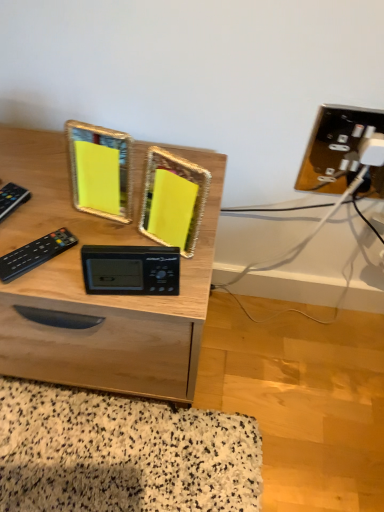
What do you see at coordinates (98, 295) in the screenshot? I see `wooden desk at center` at bounding box center [98, 295].

Image resolution: width=384 pixels, height=512 pixels. Find the location of `black plastic remote at left, which ranks as the second control in right-to-left order`. black plastic remote at left, which ranks as the second control in right-to-left order is located at coordinates (12, 198).

Considering the relative positions of black plastic clock at center and black plastic remote at left, the first control viewed from the right, in the image provided, is black plastic clock at center to the left of black plastic remote at left, the first control viewed from the right, from the viewer's perspective?

Incorrect, black plastic clock at center is not on the left side of black plastic remote at left, the first control viewed from the right.

In terms of width, does black plastic clock at center look wider or thinner when compared to black plastic remote at left, the first control viewed from the right?

Considering their sizes, black plastic clock at center looks slimmer than black plastic remote at left, the first control viewed from the right.

Looking at this image, from a real-world perspective, is black plastic clock at center physically below black plastic remote at left, arranged as the second control when viewed from the left?

No, from a real-world perspective, black plastic clock at center is not below black plastic remote at left, arranged as the second control when viewed from the left.

Considering their positions, is black plastic clock at center located in front of or behind black plastic remote at left, arranged as the second control when viewed from the left?

Visually, black plastic clock at center is located in front of black plastic remote at left, arranged as the second control when viewed from the left.

Between point (215, 192) and point (2, 190), which one is positioned behind?

The point (215, 192) is more distant.

From their relative heights in the image, would you say wooden desk at center is taller or shorter than black plastic remote at left, the 1th control viewed from the left?

In the image, wooden desk at center appears to be taller than black plastic remote at left, the 1th control viewed from the left.

Does wooden desk at center have a greater width compared to black plastic remote at left, which ranks as the second control in right-to-left order?

Correct, the width of wooden desk at center exceeds that of black plastic remote at left, which ranks as the second control in right-to-left order.

Is wooden desk at center not inside black plastic remote at left, the 1th control viewed from the left?

Yes.

Consider the image. Does wooden desk at center appear on the right side of black plastic clock at center?

In fact, wooden desk at center is to the left of black plastic clock at center.

Relative to black plastic clock at center, is wooden desk at center in front or behind?

In the image, wooden desk at center appears behind black plastic clock at center.

From a real-world perspective, is wooden desk at center physically located above or below black plastic clock at center?

In terms of real-world spatial position, wooden desk at center is below black plastic clock at center.

Does point (33, 255) appear closer or farther from the camera than point (116, 276)?

Point (33, 255) appears to be farther away from the viewer than point (116, 276).

Identify the location of the 1st control below the black plastic clock at center (from a real-world perspective). (35, 254).

Considering the relative positions of black plastic remote at left, arranged as the second control when viewed from the left, and black plastic clock at center in the image provided, is black plastic remote at left, arranged as the second control when viewed from the left, to the right of black plastic clock at center from the viewer's perspective?

Incorrect, black plastic remote at left, arranged as the second control when viewed from the left, is not on the right side of black plastic clock at center.

Is black plastic remote at left, which ranks as the second control in right-to-left order, facing towards black plastic clock at center?

No, black plastic remote at left, which ranks as the second control in right-to-left order, is not oriented towards black plastic clock at center.

Would you say black plastic clock at center is part of black plastic remote at left, the 1th control viewed from the left,'s contents?

Actually, black plastic clock at center is outside black plastic remote at left, the 1th control viewed from the left.

From the image's perspective, would you say black plastic remote at left, the 1th control viewed from the left, is positioned over black plastic clock at center?

Yes, from the image's perspective, black plastic remote at left, the 1th control viewed from the left, is above black plastic clock at center.

Is black plastic remote at left, the 1th control viewed from the left, at the right side of black plastic remote at left, arranged as the second control when viewed from the left?

In fact, black plastic remote at left, the 1th control viewed from the left, is to the left of black plastic remote at left, arranged as the second control when viewed from the left.

Is black plastic remote at left, which ranks as the second control in right-to-left order, surrounding black plastic remote at left, the first control viewed from the right?

No, black plastic remote at left, the first control viewed from the right, is not a part of black plastic remote at left, which ranks as the second control in right-to-left order.

Does black plastic remote at left, the 1th control viewed from the left, turn towards black plastic remote at left, arranged as the second control when viewed from the left?

No.

Considering the sizes of objects black plastic remote at left, the 1th control viewed from the left, and black plastic remote at left, the first control viewed from the right, in the image provided, who is taller, black plastic remote at left, the 1th control viewed from the left, or black plastic remote at left, the first control viewed from the right,?

black plastic remote at left, the first control viewed from the right.

From the image's perspective, which one is positioned lower, black plastic clock at center or black plastic remote at left, the 1th control viewed from the left?

black plastic clock at center appears lower in the image.

Can you confirm if black plastic clock at center is smaller than black plastic remote at left, the 1th control viewed from the left?

No, black plastic clock at center is not smaller than black plastic remote at left, the 1th control viewed from the left.

Is the depth of black plastic clock at center less than that of black plastic remote at left, which ranks as the second control in right-to-left order?

Yes, the depth of black plastic clock at center is less than that of black plastic remote at left, which ranks as the second control in right-to-left order.

You are a GUI agent. You are given a task and a screenshot of the screen. Output one action in this format:
    pyautogui.click(x=<x>, y=<y>)
    Task: Click on the control that is the 1st object located above the black plastic clock at center (from the image's perspective)
    
    Given the screenshot: What is the action you would take?
    pyautogui.click(x=35, y=254)

Identify the location of desk directly beneath the black plastic remote at left, the 1th control viewed from the left (from a real-world perspective). The image size is (384, 512). (98, 295).

Which object lies nearer to the anchor point black plastic remote at left, which ranks as the second control in right-to-left order, wooden desk at center or black plastic remote at left, the first control viewed from the right?

The object closer to black plastic remote at left, which ranks as the second control in right-to-left order, is black plastic remote at left, the first control viewed from the right.

Looking at the image, which one is located further to wooden desk at center, black plastic clock at center or black plastic remote at left, which ranks as the second control in right-to-left order?

black plastic remote at left, which ranks as the second control in right-to-left order, is positioned further to the anchor wooden desk at center.

When comparing their distances from black plastic remote at left, which ranks as the second control in right-to-left order, does wooden desk at center or black plastic clock at center seem closer?

black plastic clock at center lies closer to black plastic remote at left, which ranks as the second control in right-to-left order, than the other object.

Based on their spatial positions, is black plastic remote at left, the 1th control viewed from the left, or wooden desk at center closer to black plastic remote at left, arranged as the second control when viewed from the left?

black plastic remote at left, the 1th control viewed from the left, is closer to black plastic remote at left, arranged as the second control when viewed from the left.

Estimate the real-world distances between objects in this image. Which object is closer to black plastic remote at left, the 1th control viewed from the left, black plastic remote at left, arranged as the second control when viewed from the left, or black plastic clock at center?

black plastic remote at left, arranged as the second control when viewed from the left.

From the image, which object appears to be farther from black plastic remote at left, which ranks as the second control in right-to-left order, black plastic remote at left, arranged as the second control when viewed from the left, or wooden desk at center?

wooden desk at center.

Considering their positions, is black plastic remote at left, the first control viewed from the right, positioned closer to black plastic clock at center than wooden desk at center?

The object closer to black plastic clock at center is black plastic remote at left, the first control viewed from the right.

Based on the photo, estimate the real-world distances between objects in this image. Which object is further from wooden desk at center, black plastic remote at left, the first control viewed from the right, or black plastic remote at left, which ranks as the second control in right-to-left order?

black plastic remote at left, which ranks as the second control in right-to-left order, is positioned further to the anchor wooden desk at center.

I want to click on desk between black plastic remote at left, which ranks as the second control in right-to-left order, and black plastic remote at left, arranged as the second control when viewed from the left, in the horizontal direction, so click(x=98, y=295).

This screenshot has height=512, width=384. I want to click on desk situated between black plastic remote at left, the 1th control viewed from the left, and black plastic clock at center from left to right, so click(x=98, y=295).

At what (x,y) coordinates should I click in order to perform the action: click on control situated between black plastic remote at left, which ranks as the second control in right-to-left order, and black plastic clock at center from left to right. Please return your answer as a coordinate pair (x, y). Image resolution: width=384 pixels, height=512 pixels. Looking at the image, I should click on (35, 254).

This screenshot has width=384, height=512. What are the coordinates of `control between wooden desk at center and black plastic clock at center in the horizontal direction` in the screenshot? It's located at (35, 254).